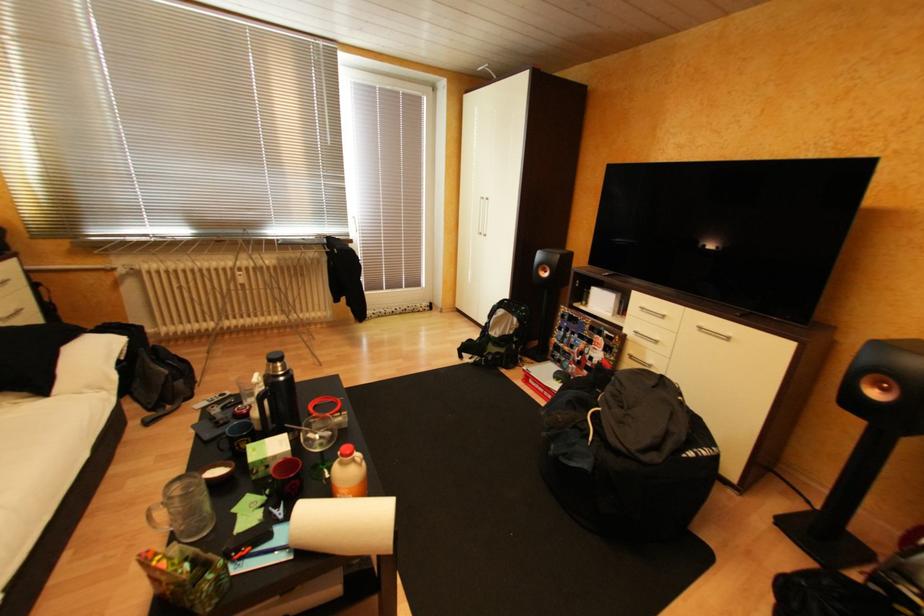
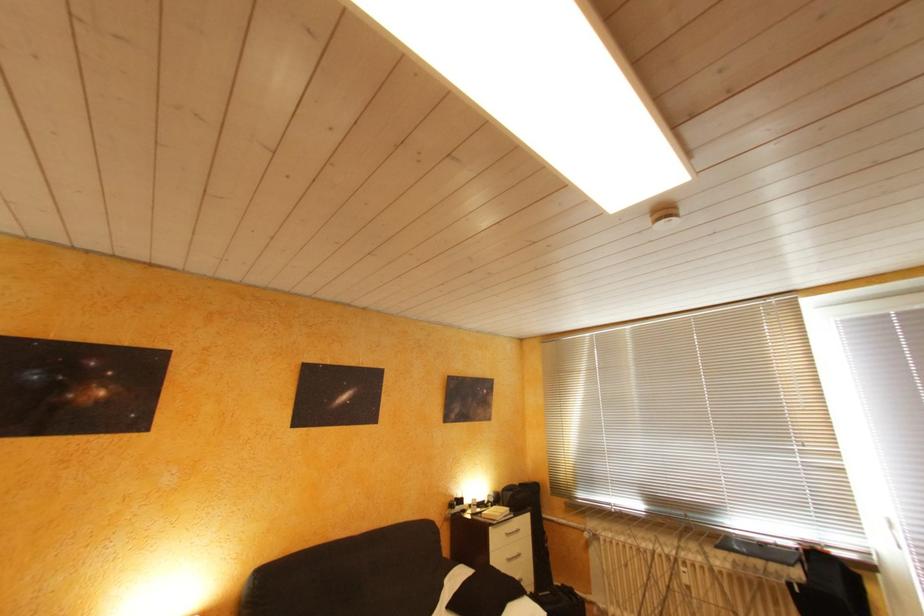
Based on the continuous images, in which direction is the camera rotating?

The camera's rotation is toward left-up.